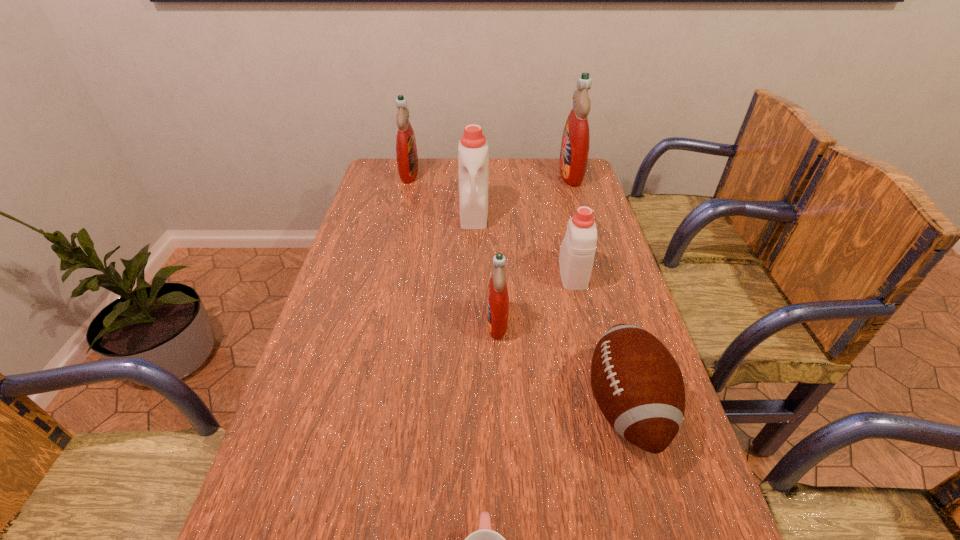
At what (x,y) coordinates should I click in order to perform the action: click on vacant region at the far edge of the desktop. Please return your answer as a coordinate pair (x, y). This screenshot has width=960, height=540. Looking at the image, I should click on (425, 160).

Where is `vacant point at the left edge`? The image size is (960, 540). vacant point at the left edge is located at coordinates (355, 375).

In order to click on free region at the right edge in this screenshot , I will do `click(587, 342)`.

Where is `vacant space at the far right corner of the desktop`? vacant space at the far right corner of the desktop is located at coordinates (579, 187).

The height and width of the screenshot is (540, 960). Identify the location of unoccupied area between the nearer white detergent and the nearest detergent. (535, 298).

The width and height of the screenshot is (960, 540). Identify the location of vacant area that lies between the leftmost detergent and the fifth nearest object. (442, 193).

At what (x,y) coordinates should I click in order to perform the action: click on unoccupied position between the third nearest object and the rightmost red detergent. Please return your answer as a coordinate pair (x, y). The width and height of the screenshot is (960, 540). Looking at the image, I should click on (534, 248).

This screenshot has height=540, width=960. What are the coordinates of `object identified as the sixth closest to the second nearest object` in the screenshot? It's located at (406, 149).

At what (x,y) coordinates should I click in order to perform the action: click on object that is the fourth nearest to the leftmost object. Please return your answer as a coordinate pair (x, y). The width and height of the screenshot is (960, 540). Looking at the image, I should click on (497, 305).

Locate an element on the screen. Image resolution: width=960 pixels, height=540 pixels. detergent identified as the second closest to the second nearest detergent is located at coordinates (473, 173).